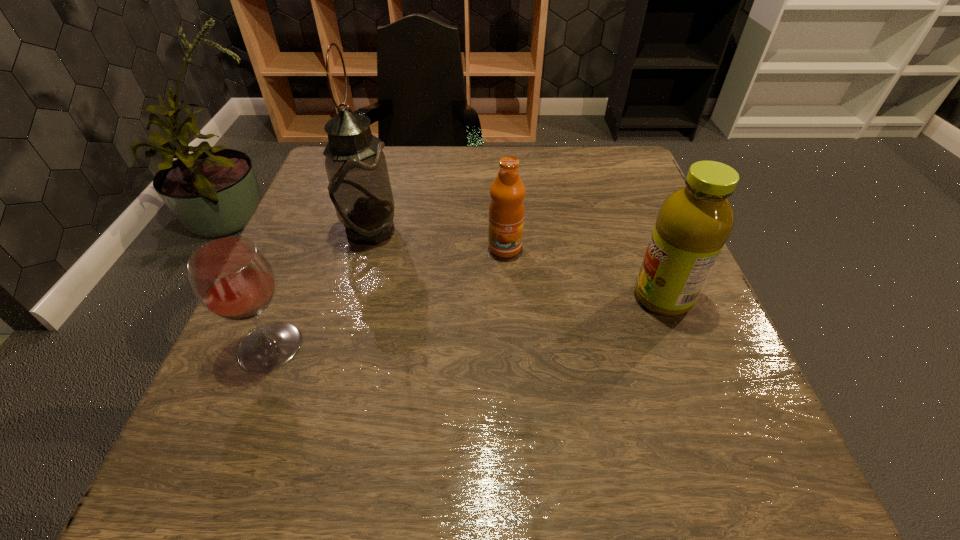
In the image, there is a desktop. Identify the location of blank space at the far right corner. This screenshot has height=540, width=960. (603, 154).

The height and width of the screenshot is (540, 960). What are the coordinates of `vacant space at the near right corner of the desktop` in the screenshot? It's located at (785, 477).

Locate an element on the screen. The width and height of the screenshot is (960, 540). free space between the left fruit juice and the wineglass is located at coordinates (388, 297).

The width and height of the screenshot is (960, 540). In order to click on vacant area that lies between the wineglass and the left fruit juice in this screenshot , I will do `click(388, 297)`.

This screenshot has width=960, height=540. Identify the location of vacant area that lies between the nearer fruit juice and the shorter fruit juice. (584, 273).

Locate an element on the screen. The height and width of the screenshot is (540, 960). vacant region between the nearest object and the oil lamp is located at coordinates (320, 289).

Where is `empty space between the left fruit juice and the nearest object`? empty space between the left fruit juice and the nearest object is located at coordinates (388, 297).

At what (x,y) coordinates should I click in order to perform the action: click on free spot between the nearer fruit juice and the tallest object. Please return your answer as a coordinate pair (x, y). Looking at the image, I should click on (516, 265).

Image resolution: width=960 pixels, height=540 pixels. In order to click on unoccupied position between the rightmost object and the nearest object in this screenshot , I will do `click(467, 322)`.

Find the location of `vacant point located between the shorter fruit juice and the oil lamp`. vacant point located between the shorter fruit juice and the oil lamp is located at coordinates (438, 240).